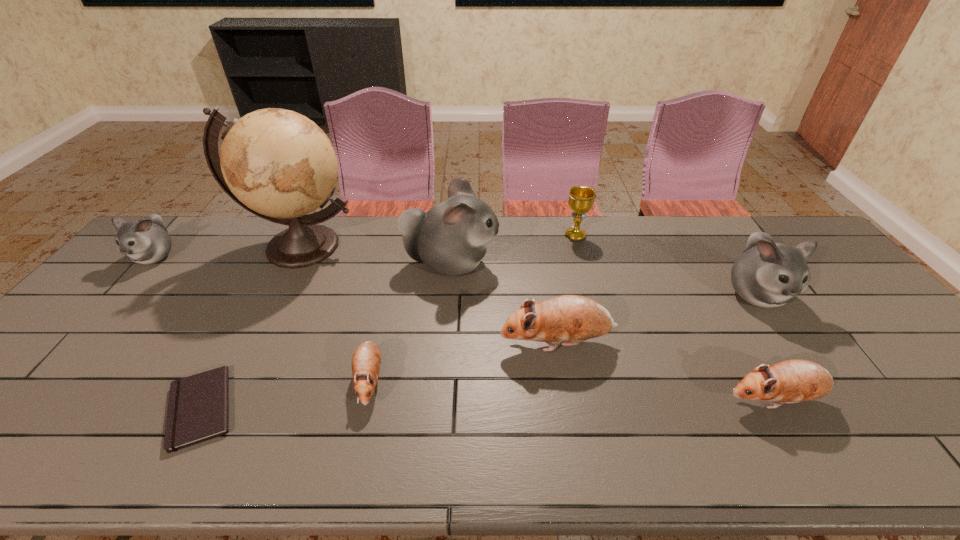
Find the location of a particular element. vacant space that is in between the second shortest hamster and the biggest brown hamster is located at coordinates (666, 372).

Find the location of a particular element. This screenshot has width=960, height=540. vacant area that lies between the leftmost brown hamster and the chalice is located at coordinates (472, 308).

Where is `vacant region between the second tallest object and the tallest object`? This screenshot has height=540, width=960. vacant region between the second tallest object and the tallest object is located at coordinates (375, 255).

Where is `object that is the fourth closest to the second brown hamster from right to left`? The height and width of the screenshot is (540, 960). object that is the fourth closest to the second brown hamster from right to left is located at coordinates (767, 274).

Identify which object is the seventh nearest to the tallest object. Please provide its 2D coordinates. Your answer should be formatted as a tuple, i.e. [(x, y)], where the tuple contains the x and y coordinates of a point satisfying the conditions above.

[(792, 381)]

In order to click on the closest hamster to the biggest white hamster in this screenshot , I will do `click(573, 318)`.

The image size is (960, 540). Identify the location of hamster object that ranks as the closest to the leftmost white hamster. (451, 239).

Choose which white hamster is the nearest neighbor to the tallest object. Please provide its 2D coordinates. Your answer should be formatted as a tuple, i.e. [(x, y)], where the tuple contains the x and y coordinates of a point satisfying the conditions above.

[(451, 239)]

The height and width of the screenshot is (540, 960). I want to click on the second closest white hamster relative to the leftmost white hamster, so pyautogui.click(x=767, y=274).

I want to click on the closest brown hamster to the checkbook, so click(x=366, y=361).